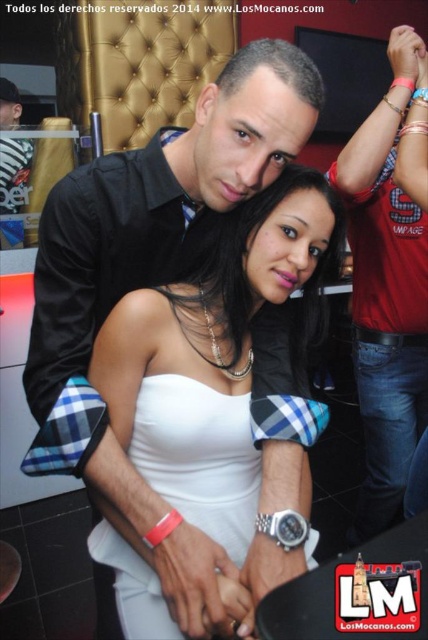
You are a photographer at a party and want to capture a photo of the white satin dress at center and the red plaid shirt at center. If the camera frame can only accommodate one of them, which one should you focus on to ensure it fits entirely within the frame?

The white satin dress at center might be wider than the red plaid shirt at center, so focusing on the white satin dress at center would be better to ensure it fits entirely within the frame.

You are taking a photo of the scene and want to focus on the point at the bottom of the image. Which point, point at [175,372] or point at [368,280], is closer to the camera and thus should be in focus?

Point at [175,372] is closer to the camera than point at [368,280], so it should be in focus.

You are at a party and want to take a photo of the red plaid shirt at center and the white matte dress at center. However, you notice that one of them is blocking the other. Which one is blocking the other?

The white matte dress at center is behind the red plaid shirt at center, so the red plaid shirt at center is blocking the white matte dress at center.